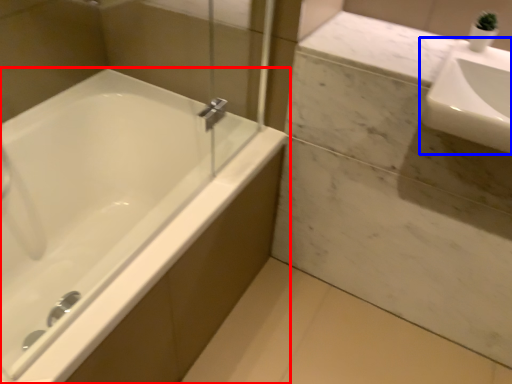
Question: Which of the following is the farthest to the observer, bathtub (highlighted by a red box) or sink (highlighted by a blue box)?

Choices:
 (A) bathtub
 (B) sink

Answer: (B)